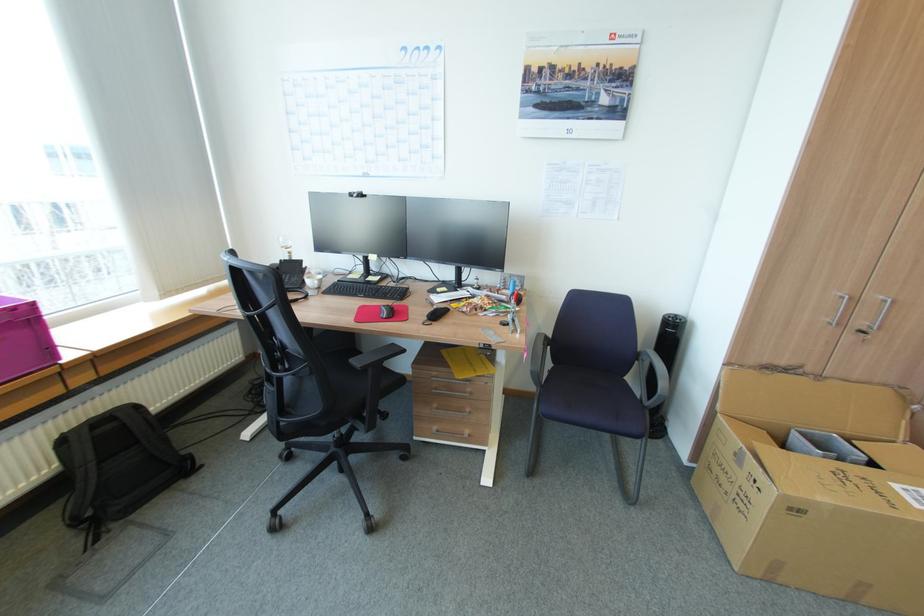
This screenshot has height=616, width=924. What do you see at coordinates (388, 350) in the screenshot?
I see `a black chair armrest` at bounding box center [388, 350].